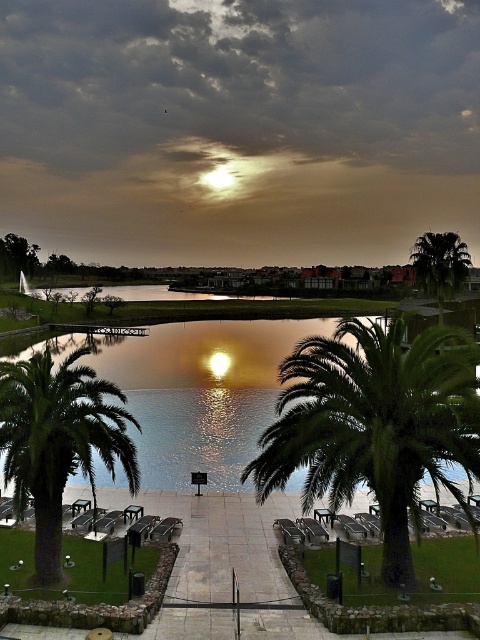
Looking at this image, you are standing at the edge of the lakeside path and want to take a photo of the green leafy palm tree at lower left. If your camera has a maximum zoom range of 15 meters, will you be able to capture the tree clearly without moving closer?

The green leafy palm tree at lower left is 14.54 meters away from the camera. Since the camera can zoom up to 15 meters, you can capture the tree clearly without moving closer.

You are standing at the lakeside and want to reach a specific point marked as point (447,385). If your walking speed is 1.5 meters per second, how long will it take you to reach that point?

The point (447,385) is 15.38 meters away from the viewer. At a walking speed of 1.5 meters per second, it will take approximately 10.25 seconds to reach the point.

You are planning to set up a small picnic area in the lakeside scene. Considering the positions and sizes of the green leafy palm tree at lower left and the green leafy palm tree at upper right, which palm tree would provide more shade coverage for your picnic spot?

The green leafy palm tree at upper right would provide more shade coverage because it has a greater width than the green leafy palm tree at lower left.